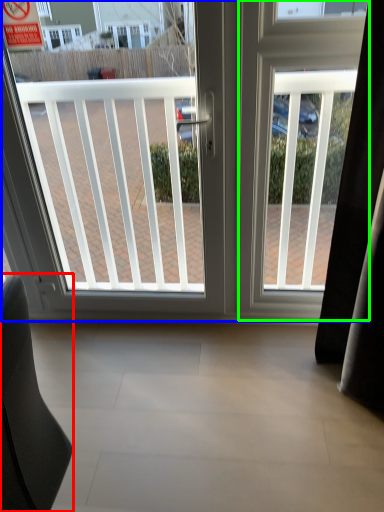
Question: Considering the real-world distances, which object is farthest from furniture (highlighted by a red box)? window (highlighted by a blue box) or screen door (highlighted by a green box)?

Choices:
 (A) window
 (B) screen door

Answer: (B)